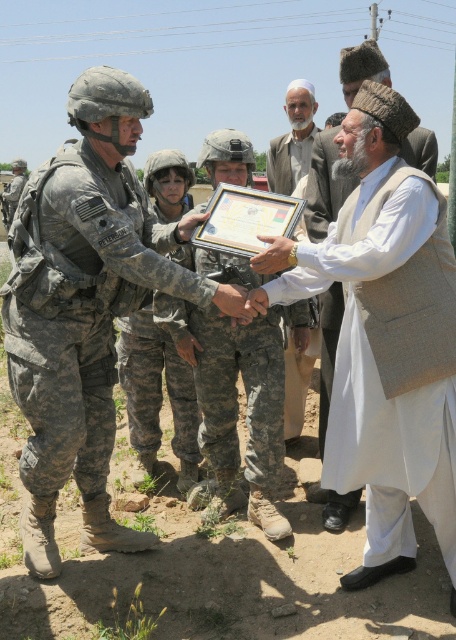
Question: Does beige woolen cap at center appear over white cotton turban at upper center?

Choices:
 (A) no
 (B) yes

Answer: (A)

Question: Among these objects, which one is nearest to the camera?

Choices:
 (A) camouflage uniform at left
 (B) beige woolen cap at center

Answer: (A)

Question: Considering the real-world distances, which object is farthest from the camouflage uniform at left?

Choices:
 (A) white cotton turban at upper center
 (B) beige woolen cap at center

Answer: (A)

Question: Does camouflage uniform at left lie behind white cotton turban at upper center?

Choices:
 (A) no
 (B) yes

Answer: (A)

Question: Observing the image, what is the correct spatial positioning of camouflage uniform at left in reference to white cotton turban at upper center?

Choices:
 (A) above
 (B) below

Answer: (B)

Question: Which object is the closest to the white cotton turban at upper center?

Choices:
 (A) camouflage uniform at left
 (B) beige woolen cap at center

Answer: (B)